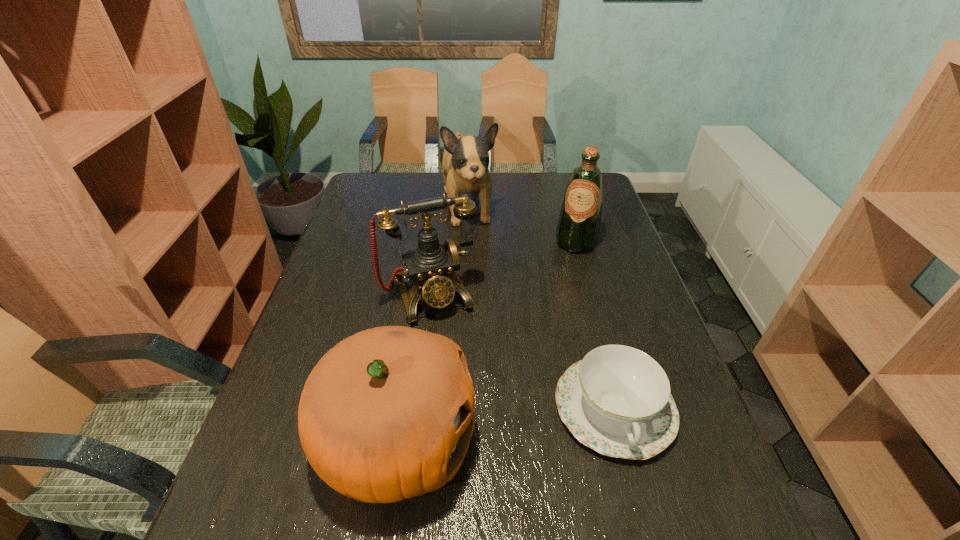
Locate an element on the screen. The image size is (960, 540). pumpkin is located at coordinates (387, 414).

The image size is (960, 540). What are the coordinates of `the shortest object` in the screenshot? It's located at (617, 400).

At what (x,y) coordinates should I click in order to perform the action: click on puppy. Please return your answer as a coordinate pair (x, y). The height and width of the screenshot is (540, 960). Looking at the image, I should click on (465, 164).

Image resolution: width=960 pixels, height=540 pixels. Identify the location of olive oil. (578, 227).

Where is `the third farthest object`? Image resolution: width=960 pixels, height=540 pixels. the third farthest object is located at coordinates (433, 267).

Where is `vacant region located on the face of the pumpkin`? This screenshot has width=960, height=540. vacant region located on the face of the pumpkin is located at coordinates (524, 441).

Where is `vacant space located at the face of the puppy`? vacant space located at the face of the puppy is located at coordinates (482, 276).

Identify the location of free space located 0.300m at the face of the puppy. The image size is (960, 540). click(490, 302).

What are the coordinates of `free spot located at the face of the puppy` in the screenshot? It's located at (494, 321).

This screenshot has height=540, width=960. In order to click on free region located on the front-facing side of the olive oil in this screenshot , I will do (564, 278).